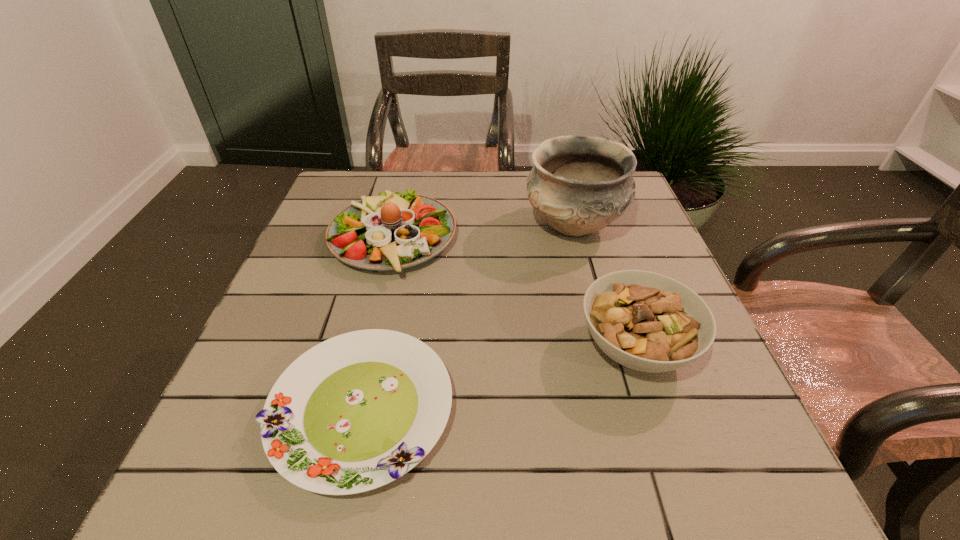
Locate an element on the screen. This screenshot has width=960, height=540. salad plate present at the far edge is located at coordinates (391, 231).

What are the coordinates of `object positioned at the near edge` in the screenshot? It's located at [357, 411].

The image size is (960, 540). What are the coordinates of `pottery at the right edge` in the screenshot? It's located at (579, 184).

At what (x,y) coordinates should I click in order to perform the action: click on stew that is positioned at the right edge. Please return your answer as a coordinate pair (x, y). The width and height of the screenshot is (960, 540). Looking at the image, I should click on (646, 321).

Find the location of a particular element. object that is at the far left corner is located at coordinates (391, 231).

Locate an element on the screen. The image size is (960, 540). object at the near left corner is located at coordinates (357, 411).

This screenshot has height=540, width=960. What are the coordinates of `object that is at the far right corner` in the screenshot? It's located at (579, 184).

This screenshot has height=540, width=960. Find the location of `vacant area at the far edge of the desktop`. vacant area at the far edge of the desktop is located at coordinates (472, 192).

Where is `vacant space at the near edge of the desktop`? The height and width of the screenshot is (540, 960). vacant space at the near edge of the desktop is located at coordinates (643, 489).

What are the coordinates of `free location at the left edge` in the screenshot? It's located at (276, 328).